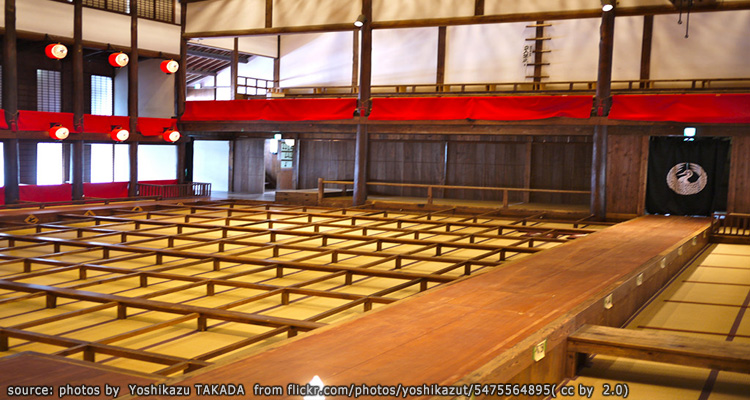
At what (x,y) coordinates should I click in order to perform the action: click on tatami floor mat. Please return your answer as a coordinate pair (x, y). This screenshot has height=400, width=750. Looking at the image, I should click on (702, 321).